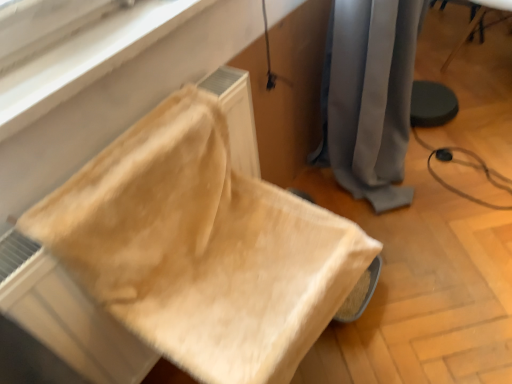
What do you see at coordinates (369, 97) in the screenshot?
I see `gray fabric curtain at center` at bounding box center [369, 97].

The width and height of the screenshot is (512, 384). Describe the element at coordinates (478, 22) in the screenshot. I see `wooden chair at lower right, positioned as the second furniture in front-to-back order` at that location.

What is the approximate height of beige fabric cushion at lower left, placed as the 2th furniture when sorted from top to bottom?

The height of beige fabric cushion at lower left, placed as the 2th furniture when sorted from top to bottom, is 15.82 inches.

Find the location of `beige fabric cushion at lower left, the second furniture positioned from the right`. beige fabric cushion at lower left, the second furniture positioned from the right is located at coordinates (201, 247).

Locate an element on the screen. This screenshot has height=384, width=512. gray fabric curtain at center is located at coordinates (369, 97).

Is gray fabric curtain at center further to the viewer compared to wooden chair at lower right, placed as the second furniture when sorted from left to right?

No, it is not.

Is gray fabric curtain at center turned away from wooden chair at lower right, the 2th furniture positioned from the bottom?

No.

In the scene shown: Does gray fabric curtain at center have a greater height compared to wooden chair at lower right, the 2th furniture positioned from the bottom?

Yes, gray fabric curtain at center is taller than wooden chair at lower right, the 2th furniture positioned from the bottom.

Looking at this image, between gray fabric curtain at center and wooden chair at lower right, positioned as the second furniture in front-to-back order, which one appears on the left side from the viewer's perspective?

Positioned to the left is gray fabric curtain at center.

Considering the sizes of objects beige fabric cushion at lower left, marked as the 2th furniture in a back-to-front arrangement, and gray fabric curtain at center in the image provided, who is thinner, beige fabric cushion at lower left, marked as the 2th furniture in a back-to-front arrangement, or gray fabric curtain at center?

With smaller width is gray fabric curtain at center.

From the picture: From a real-world perspective, between beige fabric cushion at lower left, the second furniture positioned from the right, and gray fabric curtain at center, who is vertically lower?

In real-world perspective, gray fabric curtain at center is lower.

Which of these two, beige fabric cushion at lower left, marked as the 2th furniture in a back-to-front arrangement, or gray fabric curtain at center, is smaller?

beige fabric cushion at lower left, marked as the 2th furniture in a back-to-front arrangement, is smaller.

In terms of size, does wooden chair at lower right, the first furniture when ordered from right to left, appear bigger or smaller than beige fabric cushion at lower left, which is the 1th furniture in front-to-back order?

wooden chair at lower right, the first furniture when ordered from right to left, is smaller than beige fabric cushion at lower left, which is the 1th furniture in front-to-back order.

Consider the image. Between wooden chair at lower right, positioned as the second furniture in front-to-back order, and beige fabric cushion at lower left, placed as the 2th furniture when sorted from top to bottom, which one has less height?

beige fabric cushion at lower left, placed as the 2th furniture when sorted from top to bottom.

In the scene shown: Between wooden chair at lower right, the first furniture when ordered from right to left, and beige fabric cushion at lower left, placed as the 2th furniture when sorted from top to bottom, which one is positioned in front?

beige fabric cushion at lower left, placed as the 2th furniture when sorted from top to bottom, is in front.

Which point is more distant from viewer, (484, 10) or (128, 154)?

Point (484, 10)

From the image's perspective, which object appears higher, beige fabric cushion at lower left, the second furniture positioned from the right, or wooden chair at lower right, the 2th furniture positioned from the bottom?

wooden chair at lower right, the 2th furniture positioned from the bottom, appears higher in the image.

Looking at this image, who is smaller, beige fabric cushion at lower left, which ranks as the 1th furniture in left-to-right order, or wooden chair at lower right, the 1th furniture in the back-to-front sequence?

Smaller between the two is wooden chair at lower right, the 1th furniture in the back-to-front sequence.

Is beige fabric cushion at lower left, which is the 1th furniture in front-to-back order, positioned before wooden chair at lower right, arranged as the first furniture when viewed from the top?

Yes.

Between beige fabric cushion at lower left, marked as the 2th furniture in a back-to-front arrangement, and wooden chair at lower right, the 2th furniture positioned from the bottom, which one has larger width?

beige fabric cushion at lower left, marked as the 2th furniture in a back-to-front arrangement, is wider.

Looking at this image, does wooden chair at lower right, arranged as the first furniture when viewed from the top, turn towards gray fabric curtain at center?

Yes, wooden chair at lower right, arranged as the first furniture when viewed from the top, faces towards gray fabric curtain at center.

Looking at this image, between wooden chair at lower right, the 2th furniture positioned from the bottom, and gray fabric curtain at center, which one has larger size?

gray fabric curtain at center is bigger.

Who is taller, wooden chair at lower right, arranged as the first furniture when viewed from the top, or gray fabric curtain at center?

gray fabric curtain at center is taller.

Who is more distant, wooden chair at lower right, placed as the second furniture when sorted from left to right, or gray fabric curtain at center?

wooden chair at lower right, placed as the second furniture when sorted from left to right, is more distant.

In the scene shown: Can you confirm if gray fabric curtain at center is shorter than beige fabric cushion at lower left, marked as the 2th furniture in a back-to-front arrangement?

No.

Who is smaller, gray fabric curtain at center or beige fabric cushion at lower left, the second furniture positioned from the right?

beige fabric cushion at lower left, the second furniture positioned from the right.

In the scene shown: Which object is positioned more to the left, gray fabric curtain at center or beige fabric cushion at lower left, which is the 1th furniture in front-to-back order?

Positioned to the left is beige fabric cushion at lower left, which is the 1th furniture in front-to-back order.

Relative to beige fabric cushion at lower left, which is the 1th furniture in front-to-back order, is gray fabric curtain at center in front or behind?

In the image, gray fabric curtain at center appears behind beige fabric cushion at lower left, which is the 1th furniture in front-to-back order.

Image resolution: width=512 pixels, height=384 pixels. Find the location of `furniture behind the gray fabric curtain at center`. furniture behind the gray fabric curtain at center is located at coordinates (478, 22).

In the image, there is a gray fabric curtain at center. Identify the location of furniture below it (from the image's perspective). The image size is (512, 384). (201, 247).

Looking at the image, which one is located closer to gray fabric curtain at center, beige fabric cushion at lower left, which ranks as the 1th furniture in left-to-right order, or wooden chair at lower right, positioned as the second furniture in front-to-back order?

Based on the image, beige fabric cushion at lower left, which ranks as the 1th furniture in left-to-right order, appears to be nearer to gray fabric curtain at center.

Estimate the real-world distances between objects in this image. Which object is closer to beige fabric cushion at lower left, which ranks as the 1th furniture in left-to-right order, wooden chair at lower right, arranged as the first furniture when viewed from the top, or gray fabric curtain at center?

Among the two, gray fabric curtain at center is located nearer to beige fabric cushion at lower left, which ranks as the 1th furniture in left-to-right order.

Considering their positions, is gray fabric curtain at center positioned closer to wooden chair at lower right, the 2th furniture positioned from the bottom, than beige fabric cushion at lower left, the 1th furniture when ordered from bottom to top?

The object closer to wooden chair at lower right, the 2th furniture positioned from the bottom, is gray fabric curtain at center.

Which object lies nearer to the anchor point beige fabric cushion at lower left, placed as the 2th furniture when sorted from top to bottom, gray fabric curtain at center or wooden chair at lower right, placed as the second furniture when sorted from left to right?

Based on the image, gray fabric curtain at center appears to be nearer to beige fabric cushion at lower left, placed as the 2th furniture when sorted from top to bottom.

When comparing their distances from wooden chair at lower right, positioned as the second furniture in front-to-back order, does beige fabric cushion at lower left, which ranks as the 1th furniture in left-to-right order, or gray fabric curtain at center seem further?

beige fabric cushion at lower left, which ranks as the 1th furniture in left-to-right order, is positioned further to the anchor wooden chair at lower right, positioned as the second furniture in front-to-back order.

Considering their positions, is wooden chair at lower right, the first furniture when ordered from right to left, positioned closer to gray fabric curtain at center than beige fabric cushion at lower left, the 1th furniture when ordered from bottom to top?

beige fabric cushion at lower left, the 1th furniture when ordered from bottom to top.

Image resolution: width=512 pixels, height=384 pixels. Identify the location of curtain situated between beige fabric cushion at lower left, which is the 1th furniture in front-to-back order, and wooden chair at lower right, placed as the second furniture when sorted from left to right, from left to right. (369, 97).